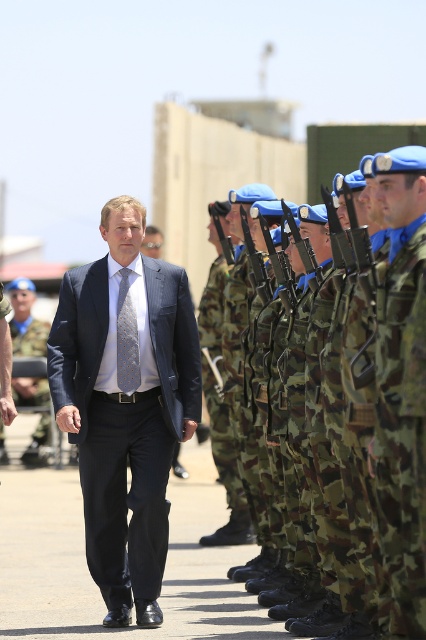
From the picture: You are a photographer trying to capture both the navy blue suit at center and the camo fabric uniform at center in a single frame. Based on their widths, can you fit both in the frame without cropping either of them?

The navy blue suit at center might be wider than the camo fabric uniform at center, so there is a possibility that both can fit in the frame if the camera is positioned appropriately to accommodate their widths.